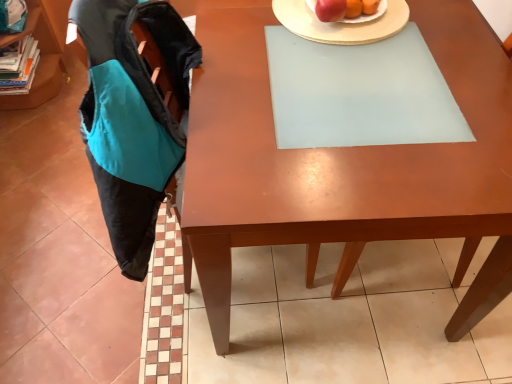
I want to click on vacant area that is situated to the right of shiny red apple at upper center, so click(420, 22).